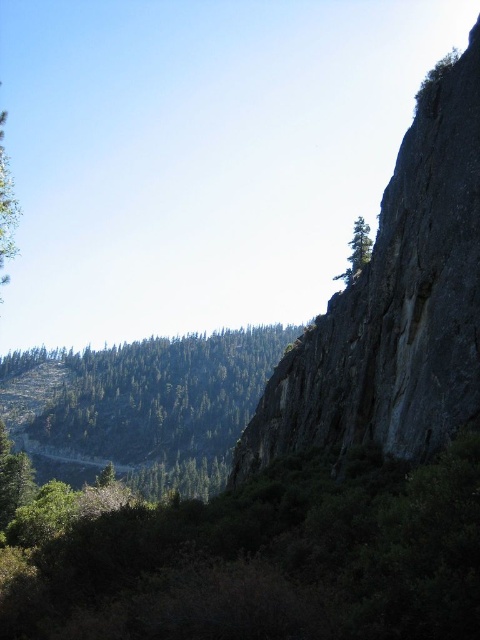
Question: Can you confirm if green leafy tree at lower center is smaller than green leafy tree at left?

Choices:
 (A) no
 (B) yes

Answer: (B)

Question: Estimate the real-world distances between objects in this image. Which object is farther from the green matte tree at upper center?

Choices:
 (A) green leafy tree at left
 (B) dark gray rock at right
 (C) green leafy tree at lower center
 (D) green textured trees at center

Answer: (D)

Question: Does green leafy tree at lower center have a smaller size compared to green textured trees at center?

Choices:
 (A) no
 (B) yes

Answer: (B)

Question: Is the position of green leafy tree at left less distant than that of green matte tree at upper center?

Choices:
 (A) no
 (B) yes

Answer: (B)

Question: Among these points, which one is nearest to the camera?

Choices:
 (A) (216, 577)
 (B) (476, 211)

Answer: (A)

Question: Estimate the real-world distances between objects in this image. Which object is closer to the green matte tree at upper center?

Choices:
 (A) green leafy tree at lower center
 (B) dark gray rock at right
 (C) green leafy tree at left

Answer: (B)